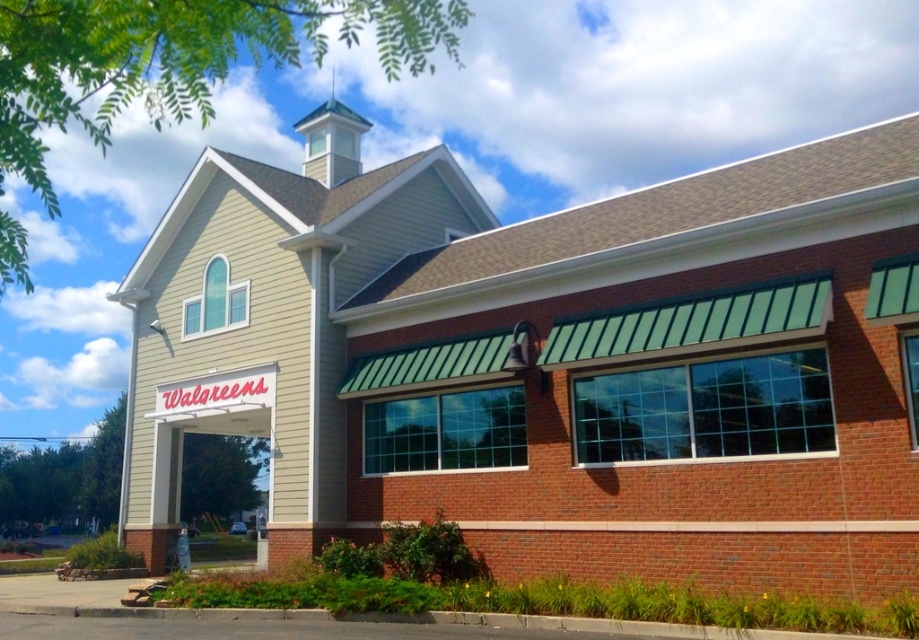
Based on the photo, you are standing in front of the Walgreens store and want to hang a banner between the white matte Walgreens sign at center and the green glass spire at upper center. Which object is shorter so the banner can be properly anchored?

The white matte Walgreens sign at center is not as tall as the green glass spire at upper center, so the banner should be anchored to the shorter white matte Walgreens sign at center to ensure proper placement.